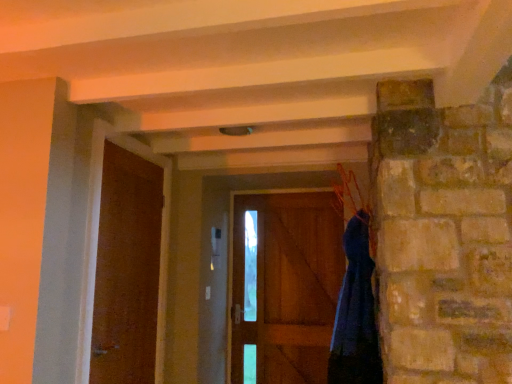
The width and height of the screenshot is (512, 384). Describe the element at coordinates (349, 194) in the screenshot. I see `blue fabric hanger at upper right` at that location.

This screenshot has height=384, width=512. Find the location of `dark blue fabric at right`. dark blue fabric at right is located at coordinates (356, 313).

Describe the element at coordinates (288, 286) in the screenshot. I see `brown wooden door at center, positioned as the first door in right-to-left order` at that location.

Describe the element at coordinates (127, 270) in the screenshot. I see `wooden door at left, positioned as the second door in right-to-left order` at that location.

I want to click on blue fabric hanger at upper right, so click(349, 194).

How far apart are blue fabric hanger at upper right and dark blue fabric at right?

blue fabric hanger at upper right is 18.33 inches away from dark blue fabric at right.

Between blue fabric hanger at upper right and dark blue fabric at right, which one has smaller size?

With smaller size is blue fabric hanger at upper right.

Is blue fabric hanger at upper right far from dark blue fabric at right?

blue fabric hanger at upper right is actually quite close to dark blue fabric at right.

Considering the relative positions of blue fabric hanger at upper right and dark blue fabric at right in the image provided, is blue fabric hanger at upper right behind dark blue fabric at right?

That is False.

Considering the sizes of objects dark blue fabric at right and brown wooden door at center, placed as the 2th door when sorted from front to back, in the image provided, who is shorter, dark blue fabric at right or brown wooden door at center, placed as the 2th door when sorted from front to back,?

dark blue fabric at right.

Is dark blue fabric at right facing away from brown wooden door at center, arranged as the second door when viewed from the left?

dark blue fabric at right is not turned away from brown wooden door at center, arranged as the second door when viewed from the left.

How different are the orientations of dark blue fabric at right and brown wooden door at center, placed as the 2th door when sorted from front to back, in degrees?

dark blue fabric at right and brown wooden door at center, placed as the 2th door when sorted from front to back, are facing 87.1 degrees away from each other.

Is dark blue fabric at right behind brown wooden door at center, placed as the 2th door when sorted from front to back?

No, it is not.

Consider the image. Can you tell me how much blue fabric hanger at upper right and brown wooden door at center, arranged as the second door when viewed from the left, differ in facing direction?

88.9 degrees separate the facing orientations of blue fabric hanger at upper right and brown wooden door at center, arranged as the second door when viewed from the left.

Is point (346, 187) less distant than point (260, 275)?

Yes, point (346, 187) is closer to viewer.

From the image's perspective, count 2nd doors downward from the blue fabric hanger at upper right and point to it. Please provide its 2D coordinates.

[(288, 286)]

From their relative heights in the image, would you say blue fabric hanger at upper right is taller or shorter than brown wooden door at center, placed as the 2th door when sorted from front to back?

blue fabric hanger at upper right is shorter than brown wooden door at center, placed as the 2th door when sorted from front to back.

In the scene shown: Can you tell me how much wooden door at left, which is the second door in back-to-front order, and dark blue fabric at right differ in facing direction?

There is a 178-degree angle between the facing directions of wooden door at left, which is the second door in back-to-front order, and dark blue fabric at right.

At what (x,y) coordinates should I click in order to perform the action: click on door that is above the dark blue fabric at right (from the image's perspective). Please return your answer as a coordinate pair (x, y). Looking at the image, I should click on (127, 270).

From the image's perspective, is wooden door at left, which is the second door in back-to-front order, located above dark blue fabric at right?

Yes.

Considering the relative sizes of wooden door at left, marked as the 1th door in a front-to-back arrangement, and brown wooden door at center, arranged as the second door when viewed from the left, in the image provided, is wooden door at left, marked as the 1th door in a front-to-back arrangement, bigger than brown wooden door at center, arranged as the second door when viewed from the left,?

Correct, wooden door at left, marked as the 1th door in a front-to-back arrangement, is larger in size than brown wooden door at center, arranged as the second door when viewed from the left.

Considering the relative positions of wooden door at left, which is the second door in back-to-front order, and brown wooden door at center, which is the first door from back to front, in the image provided, is wooden door at left, which is the second door in back-to-front order, to the right of brown wooden door at center, which is the first door from back to front, from the viewer's perspective?

No.

Which object is further away from the camera taking this photo, wooden door at left, positioned as the second door in right-to-left order, or brown wooden door at center, which is the first door from back to front?

brown wooden door at center, which is the first door from back to front.

Between point (135, 323) and point (300, 225), which one is positioned behind?

Point (300, 225)

Is brown wooden door at center, which is the first door from back to front, directly adjacent to wooden door at left, which is counted as the first door, starting from the left?

No, brown wooden door at center, which is the first door from back to front, is not beside wooden door at left, which is counted as the first door, starting from the left.

How distant is brown wooden door at center, positioned as the first door in right-to-left order, from wooden door at left, marked as the 1th door in a front-to-back arrangement?

A distance of 4.00 feet exists between brown wooden door at center, positioned as the first door in right-to-left order, and wooden door at left, marked as the 1th door in a front-to-back arrangement.

Is brown wooden door at center, positioned as the first door in right-to-left order, positioned with its back to wooden door at left, which is the second door in back-to-front order?

No, brown wooden door at center, positioned as the first door in right-to-left order,'s orientation is not away from wooden door at left, which is the second door in back-to-front order.

From the image's perspective, which object appears higher, brown wooden door at center, arranged as the second door when viewed from the left, or wooden door at left, which is the second door in back-to-front order?

wooden door at left, which is the second door in back-to-front order.

Does wooden door at left, marked as the 1th door in a front-to-back arrangement, contain blue fabric hanger at upper right?

No.

Does wooden door at left, which is the second door in back-to-front order, have a greater width compared to blue fabric hanger at upper right?

No, wooden door at left, which is the second door in back-to-front order, is not wider than blue fabric hanger at upper right.

Is wooden door at left, positioned as the second door in right-to-left order, oriented away from blue fabric hanger at upper right?

wooden door at left, positioned as the second door in right-to-left order, does not have its back to blue fabric hanger at upper right.

The width and height of the screenshot is (512, 384). I want to click on dress lying below the blue fabric hanger at upper right (from the image's perspective), so click(x=356, y=313).

This screenshot has width=512, height=384. In order to click on door that is the 1st object above the dark blue fabric at right (from a real-world perspective) in this screenshot , I will do `click(288, 286)`.

Which object lies nearer to the anchor point wooden door at left, which is counted as the first door, starting from the left, brown wooden door at center, positioned as the first door in right-to-left order, or dark blue fabric at right?

The object closer to wooden door at left, which is counted as the first door, starting from the left, is dark blue fabric at right.

Considering their positions, is dark blue fabric at right positioned further to blue fabric hanger at upper right than brown wooden door at center, arranged as the second door when viewed from the left?

brown wooden door at center, arranged as the second door when viewed from the left.

Based on their spatial positions, is blue fabric hanger at upper right or dark blue fabric at right closer to brown wooden door at center, which is the first door from back to front?

blue fabric hanger at upper right.

Consider the image. Which object lies nearer to the anchor point blue fabric hanger at upper right, brown wooden door at center, which is the first door from back to front, or dark blue fabric at right?

dark blue fabric at right lies closer to blue fabric hanger at upper right than the other object.

Considering their positions, is wooden door at left, marked as the 1th door in a front-to-back arrangement, positioned further to brown wooden door at center, positioned as the first door in right-to-left order, than blue fabric hanger at upper right?

Among the two, wooden door at left, marked as the 1th door in a front-to-back arrangement, is located further to brown wooden door at center, positioned as the first door in right-to-left order.

Based on their spatial positions, is brown wooden door at center, positioned as the first door in right-to-left order, or blue fabric hanger at upper right closer to dark blue fabric at right?

blue fabric hanger at upper right.

Considering their positions, is wooden door at left, which is counted as the first door, starting from the left, positioned closer to brown wooden door at center, which is the first door from back to front, than dark blue fabric at right?

dark blue fabric at right lies closer to brown wooden door at center, which is the first door from back to front, than the other object.

Which object lies nearer to the anchor point dark blue fabric at right, wooden door at left, which is counted as the first door, starting from the left, or brown wooden door at center, arranged as the second door when viewed from the left?

Based on the image, brown wooden door at center, arranged as the second door when viewed from the left, appears to be nearer to dark blue fabric at right.

Find the location of a particular element. dress between blue fabric hanger at upper right and brown wooden door at center, which is the first door from back to front, along the z-axis is located at coordinates (356, 313).

This screenshot has width=512, height=384. Identify the location of dress positioned between wooden door at left, positioned as the second door in right-to-left order, and brown wooden door at center, positioned as the first door in right-to-left order, from near to far. (356, 313).

Where is `hanger between wooden door at left, positioned as the second door in right-to-left order, and brown wooden door at center, which is the first door from back to front, in the front-back direction`? hanger between wooden door at left, positioned as the second door in right-to-left order, and brown wooden door at center, which is the first door from back to front, in the front-back direction is located at coordinates (349, 194).

This screenshot has width=512, height=384. In order to click on dress located between wooden door at left, positioned as the second door in right-to-left order, and blue fabric hanger at upper right in the left-right direction in this screenshot , I will do `click(356, 313)`.